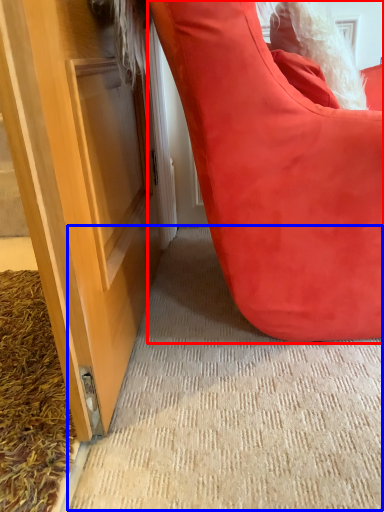
Question: Which object is closer to the camera taking this photo, furniture (highlighted by a red box) or doormat (highlighted by a blue box)?

Choices:
 (A) furniture
 (B) doormat

Answer: (A)